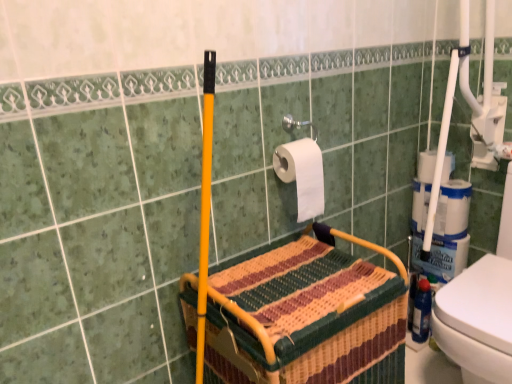
Question: Visually, is white matte toilet paper at upper center, marked as the 1th toilet paper in a left-to-right arrangement, positioned to the left or to the right of blue plastic bottle at lower right?

Choices:
 (A) left
 (B) right

Answer: (A)

Question: Considering their positions, is white matte toilet paper at upper center, the 1th toilet paper from the front, located in front of or behind blue plastic bottle at lower right?

Choices:
 (A) behind
 (B) front

Answer: (B)

Question: Which object is positioned farthest from the woven fabric basket at center?

Choices:
 (A) blue plastic bottle at lower right
 (B) white matte toilet paper at upper center, the 1th toilet paper from the front
 (C) white matte toilet paper at right, which is counted as the first toilet paper, starting from the right

Answer: (A)

Question: Estimate the real-world distances between objects in this image. Which object is closer to the white matte toilet paper at upper center, which is the 2th toilet paper from right to left?

Choices:
 (A) woven fabric basket at center
 (B) blue plastic bottle at lower right
 (C) white matte toilet paper at right, which is counted as the first toilet paper, starting from the right

Answer: (A)